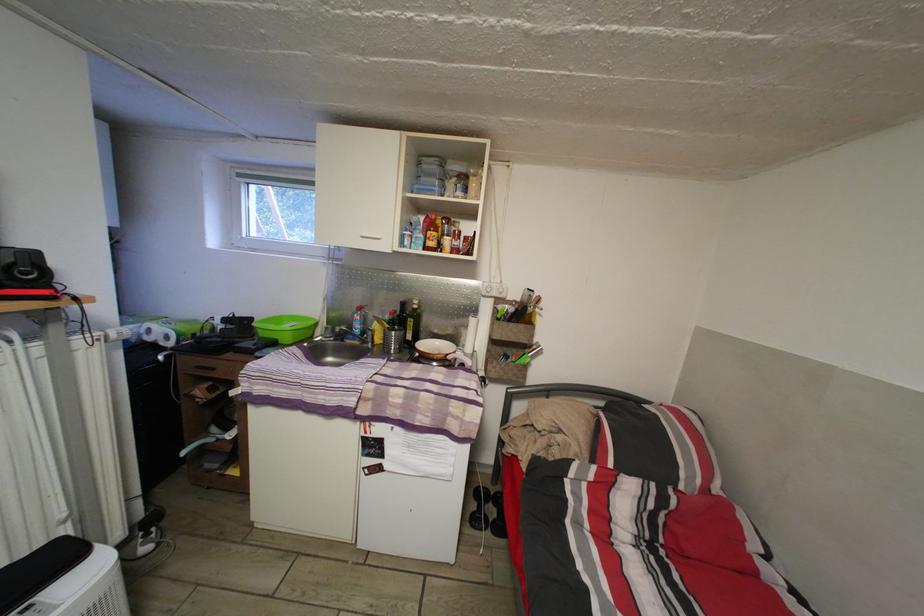
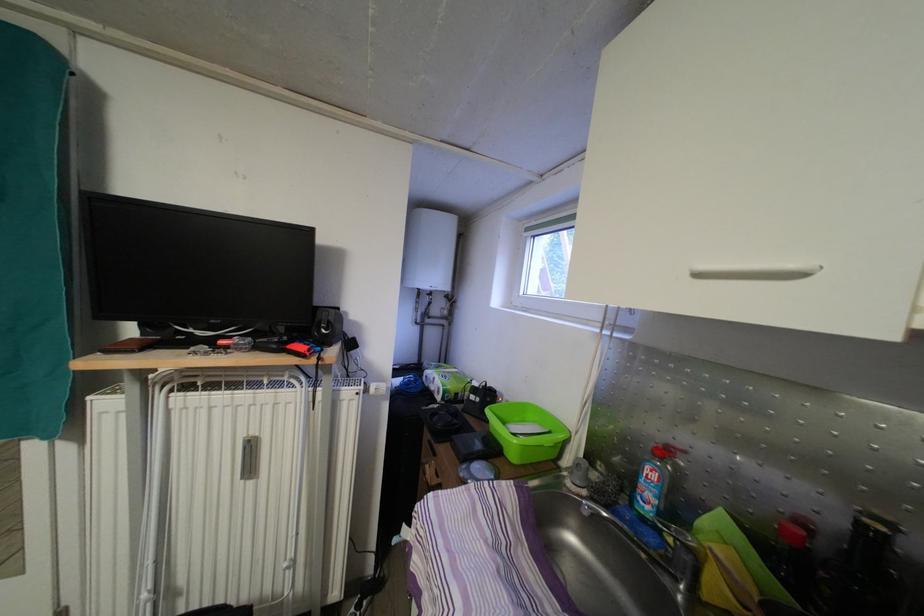
The point at (x=384, y=244) is marked in the first image. Where is the corresponding point in the second image?

(800, 272)